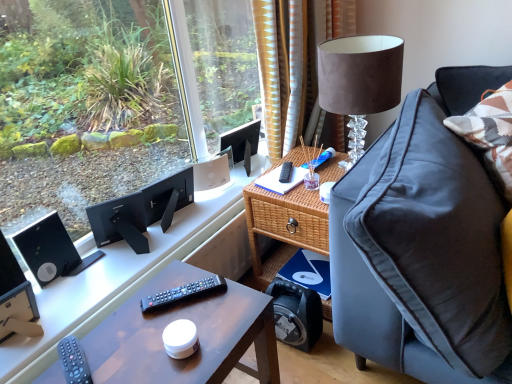
Find the location of `vacant point to the right of black plastic remote at center, the second remote control in the top-to-bottom sequence`. vacant point to the right of black plastic remote at center, the second remote control in the top-to-bottom sequence is located at coordinates (229, 305).